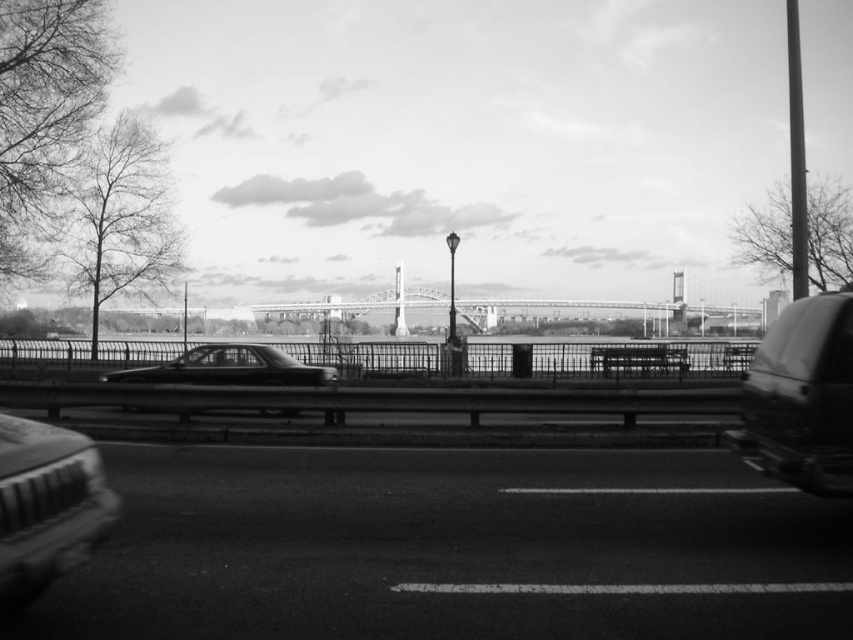
Question: Among these objects, which one is farthest from the camera?

Choices:
 (A) shiny black sedan at center
 (B) metallic silver car at lower left
 (C) asphalt road at center
 (D) metallic gray car at right

Answer: (A)

Question: Which object appears farthest from the camera in this image?

Choices:
 (A) metallic silver car at lower left
 (B) metallic gray car at right
 (C) asphalt road at center

Answer: (B)

Question: Which of the following is the farthest from the observer?

Choices:
 (A) metallic gray car at right
 (B) metallic silver car at lower left
 (C) shiny black sedan at center
 (D) asphalt road at center

Answer: (C)

Question: Can you confirm if asphalt road at center is positioned below metallic gray car at right?

Choices:
 (A) no
 (B) yes

Answer: (B)

Question: Does metallic gray car at right appear under metallic silver car at lower left?

Choices:
 (A) yes
 (B) no

Answer: (A)

Question: From the image, what is the correct spatial relationship of asphalt road at center in relation to metallic silver car at lower left?

Choices:
 (A) left
 (B) right

Answer: (B)